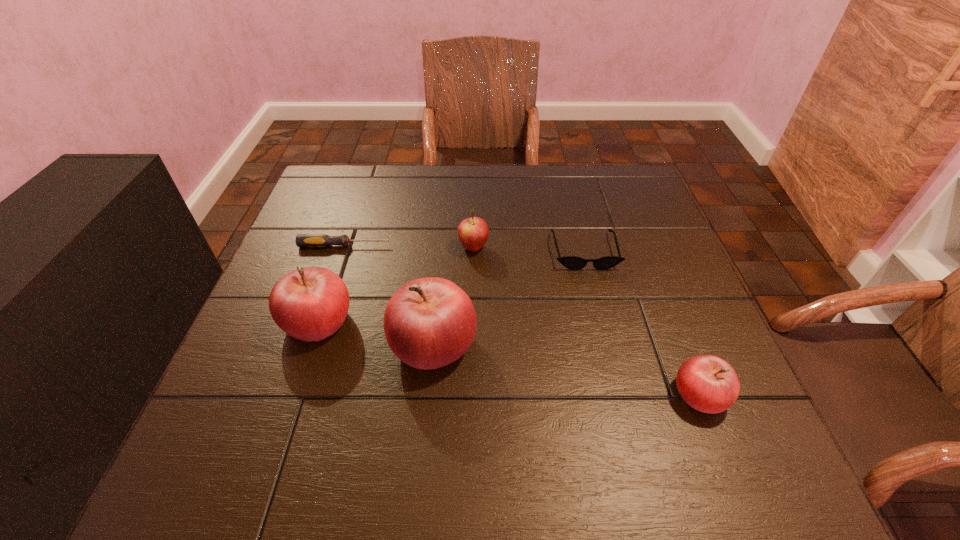
The height and width of the screenshot is (540, 960). What are the coordinates of `blank space at the left edge of the desktop` in the screenshot? It's located at (323, 260).

Where is `vacant space at the right edge`? vacant space at the right edge is located at coordinates (698, 338).

Identify the location of vacant space at the far left corner of the desktop. Image resolution: width=960 pixels, height=540 pixels. (362, 207).

Find the location of a particular element. The height and width of the screenshot is (540, 960). free point at the far right corner is located at coordinates (649, 203).

At what (x,y) coordinates should I click in order to perform the action: click on vacant space that is in between the rightmost object and the screwdriver. Please return your answer as a coordinate pair (x, y). This screenshot has height=540, width=960. Looking at the image, I should click on (522, 320).

Locate an element on the screen. This screenshot has width=960, height=540. empty location between the shortest object and the second shortest object is located at coordinates (465, 248).

This screenshot has width=960, height=540. Find the location of `free point between the fourth tallest object and the shortest object`. free point between the fourth tallest object and the shortest object is located at coordinates (522, 320).

At what (x,y) coordinates should I click in order to perform the action: click on vacant area that lies between the screwdriver and the rightmost apple. Please return your answer as a coordinate pair (x, y). Looking at the image, I should click on (522, 320).

Identify the location of free spot between the screwdriver and the farthest apple. The width and height of the screenshot is (960, 540). (409, 246).

You are a GUI agent. You are given a task and a screenshot of the screen. Output one action in this format:
    pyautogui.click(x=<x>, y=<y>)
    Task: Click on the free point between the rightmost object and the sunglasses
    
    Given the screenshot: What is the action you would take?
    [x=642, y=323]